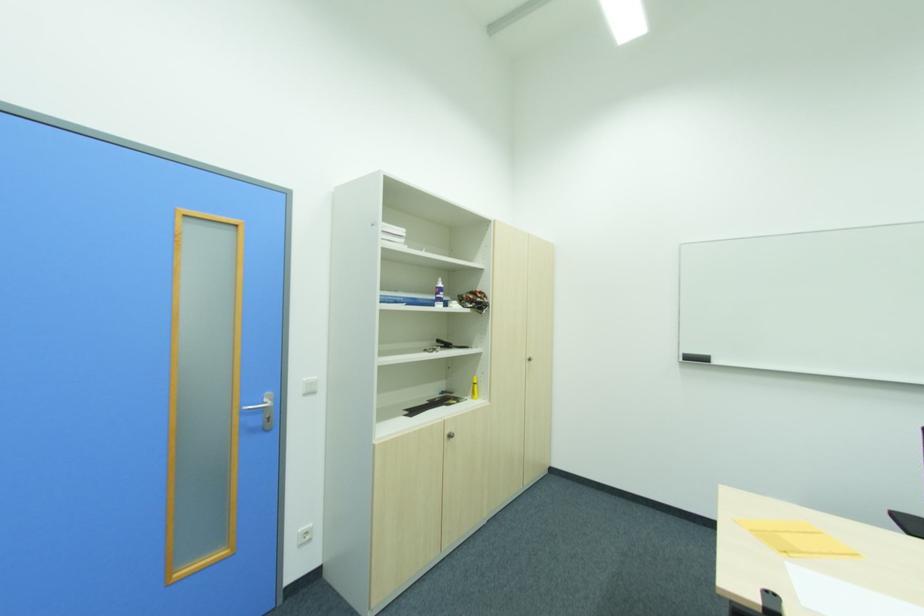
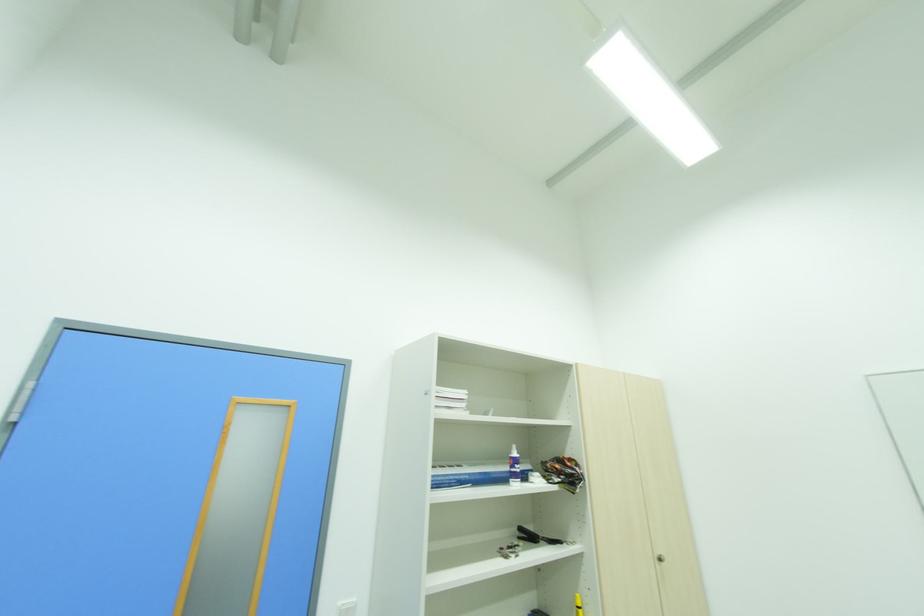
In the second image, find the point that corresponds to pixel 309 379 in the first image.

(344, 604)